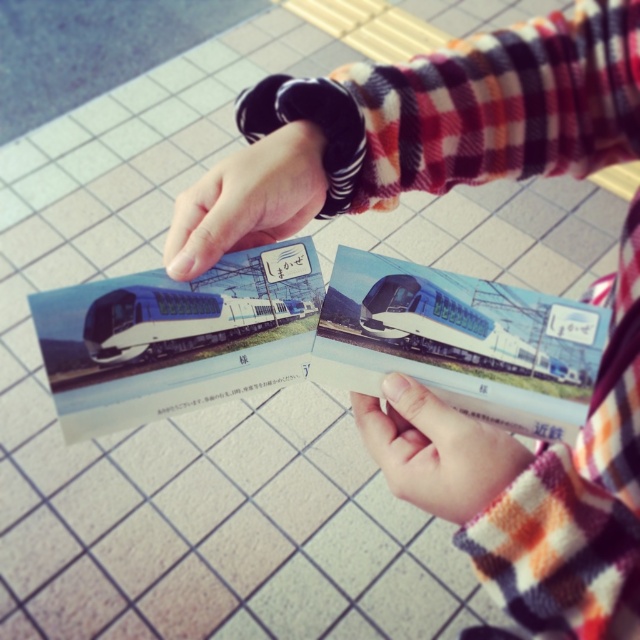
You are trying to decide which object to grab first between the plaid fabric arm at center and the smooth black wristwatch at upper center. Since you want to pick the bigger one, which should you choose?

The plaid fabric arm at center is larger than the smooth black wristwatch at upper center, so you should choose the plaid fabric arm at center.

You are a photographer trying to capture the silver metallic train at center in a photo. The smooth skin hand at center is blocking your view. Can you move the hand to get a clear shot of the train?

The smooth skin hand at center is closer to the viewer than the silver metallic train at center, so moving the hand would allow the photographer to capture the train without obstruction.

You are trying to determine if the smooth skin hand at center can comfortably wear the smooth black wristwatch at upper center. Based on the scene description, can the hand fit the wristwatch?

The smooth skin hand at center is thinner than the smooth black wristwatch at upper center, which suggests that the hand might be too narrow to comfortably fit the wristwatch.